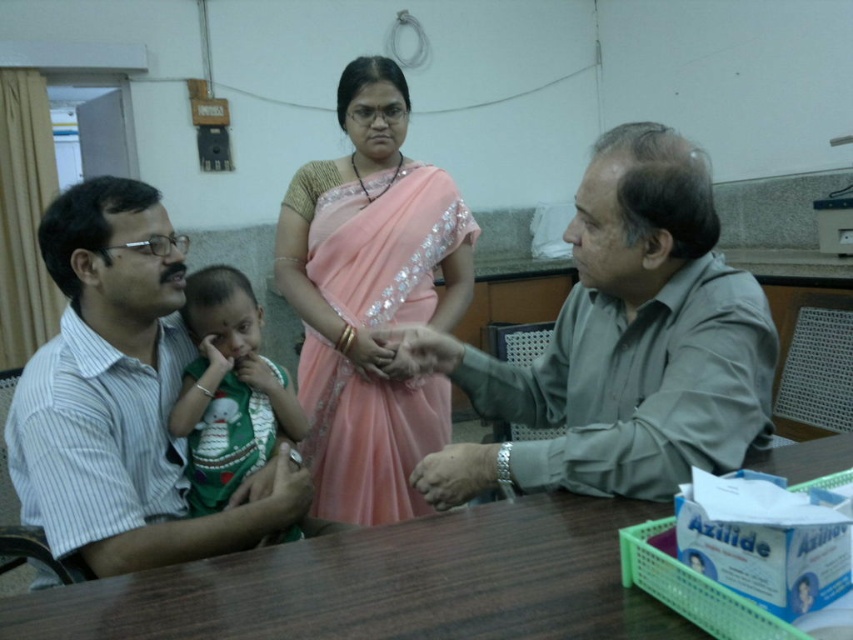
Is gray matte shirt at center bigger than green knitted sweater at left?

Yes, gray matte shirt at center is bigger than green knitted sweater at left.

Who is more distant from viewer, (x=469, y=484) or (x=260, y=435)?

The point (x=260, y=435) is more distant.

Where is `gray matte shirt at center`? This screenshot has height=640, width=853. gray matte shirt at center is located at coordinates (631, 337).

Between wooden table at center and white striped shirt at left, which one is positioned lower?

wooden table at center

Between point (189, 608) and point (132, 273), which one is positioned behind?

Positioned behind is point (132, 273).

You are a GUI agent. You are given a task and a screenshot of the screen. Output one action in this format:
    pyautogui.click(x=<x>, y=<y>)
    Task: Click on the wooden table at center
    
    Given the screenshot: What is the action you would take?
    pyautogui.click(x=386, y=584)

The width and height of the screenshot is (853, 640). What are the coordinates of `wooden table at center` in the screenshot? It's located at (386, 584).

Does wooden table at center come behind pink satin saree at center?

That is False.

Based on the photo, does wooden table at center have a lesser height compared to pink satin saree at center?

Indeed, wooden table at center has a lesser height compared to pink satin saree at center.

Who is more distant from viewer, (367, 550) or (402, 406)?

The point (402, 406) is more distant.

Identify the location of wooden table at center. (386, 584).